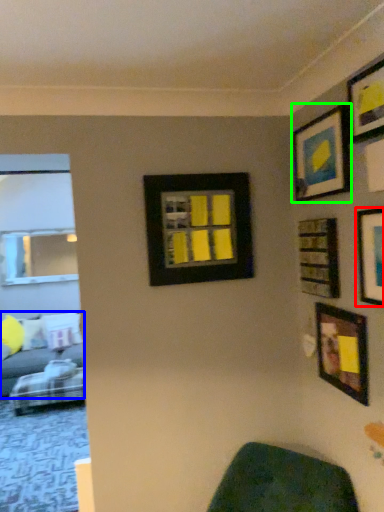
Question: Which object is the farthest from picture frame (highlighted by a red box)? Choose among these: studio couch (highlighted by a blue box) or picture frame (highlighted by a green box).

Choices:
 (A) studio couch
 (B) picture frame

Answer: (A)